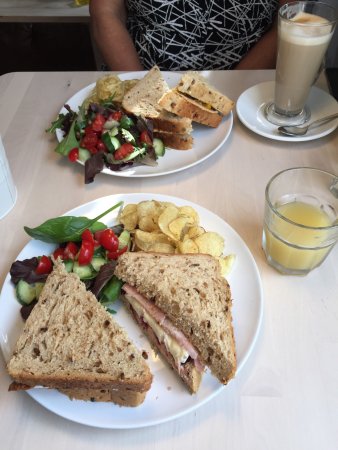
Where is `2 white plates`? 2 white plates is located at coordinates (218, 222), (178, 153).